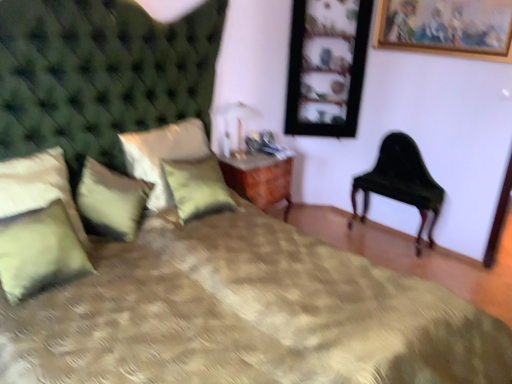
Question: From a real-world perspective, relative to green textured pillow at center, which appears as the second pillow when viewed from the right, is wooden picture frame at upper right, placed as the 1th picture frame when sorted from left to right, vertically above or below?

Choices:
 (A) below
 (B) above

Answer: (B)

Question: From their relative heights in the image, would you say wooden picture frame at upper right, placed as the 1th picture frame when sorted from left to right, is taller or shorter than green textured pillow at center, which appears as the second pillow when viewed from the right?

Choices:
 (A) short
 (B) tall

Answer: (B)

Question: Estimate the real-world distances between objects in this image. Which object is closer to the green velvet pillow at lower left, which is counted as the second pillow, starting from the left?

Choices:
 (A) green velvet pillow at left, which is the third pillow from right to left
 (B) gold-framed picture at upper right, placed as the first picture frame when sorted from front to back
 (C) green textured pillow at center, arranged as the 1th pillow when viewed from the right
 (D) green velvet chair at right
 (E) metallic gold table lamp at upper center

Answer: (A)

Question: Which object is positioned farthest from the green textured pillow at center, the 5th pillow when ordered from left to right?

Choices:
 (A) green velvet chair at right
 (B) green velvet pillow at lower left, which is counted as the second pillow, starting from the left
 (C) wooden nightstand at center
 (D) metallic gold table lamp at upper center
 (E) soft green fabric pillow at left, arranged as the first pillow when viewed from the left

Answer: (A)